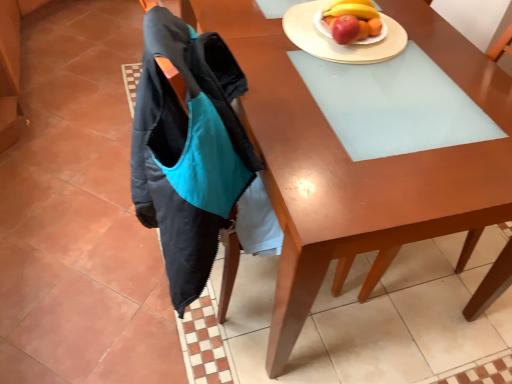
Where is `free space in front of matte wood chair at upper right`? free space in front of matte wood chair at upper right is located at coordinates (407, 333).